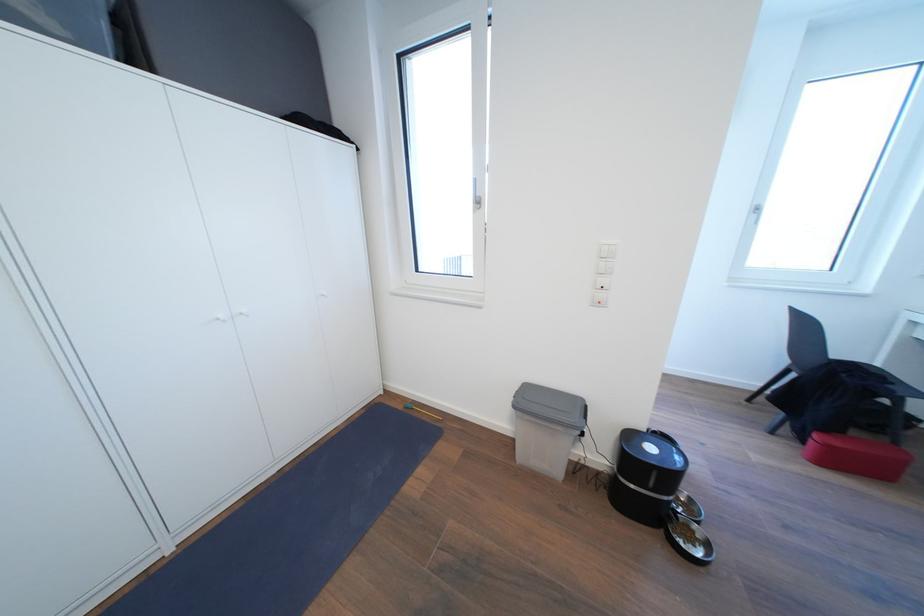
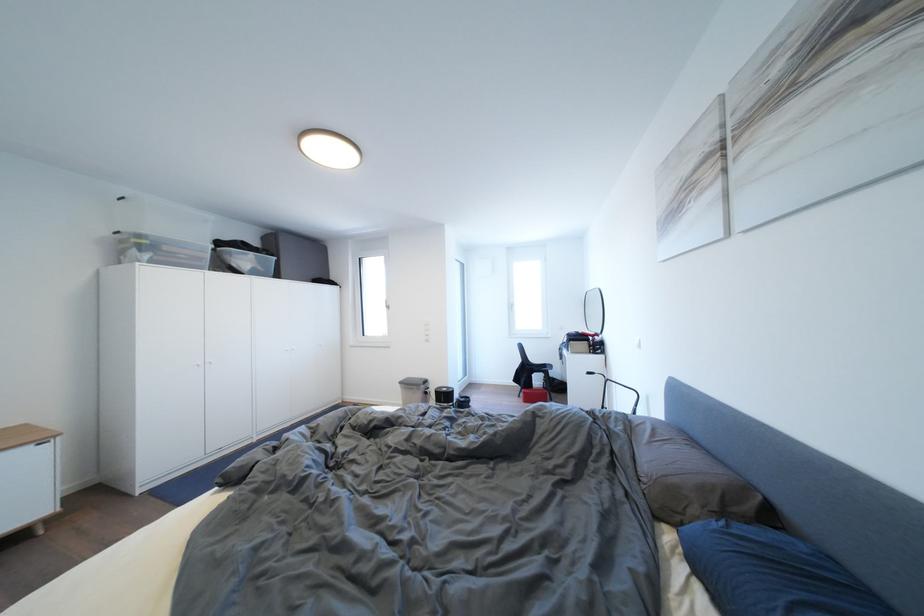
Find the pixel in the second image that matches [835,451] in the first image.

(532, 398)